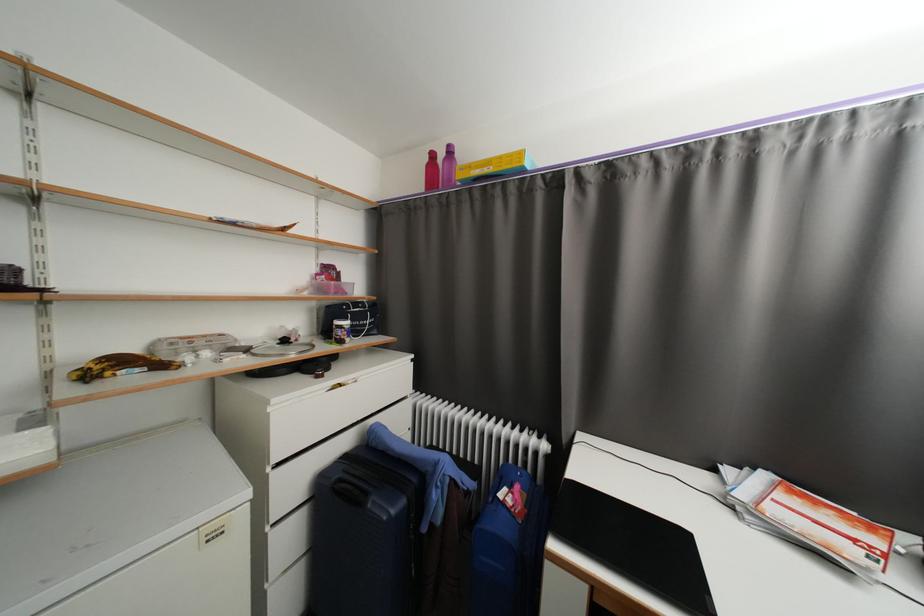
This screenshot has width=924, height=616. Describe the element at coordinates (349, 491) in the screenshot. I see `a black suitcase handle` at that location.